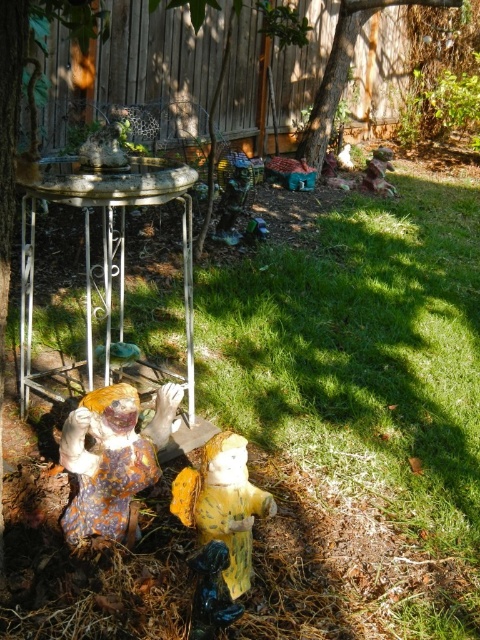
Does metallic silver table at center-left have a larger size compared to speckled ceramic figurine at lower left?

Yes, metallic silver table at center-left is bigger than speckled ceramic figurine at lower left.

Can you confirm if metallic silver table at center-left is positioned above speckled ceramic figurine at lower left?

Yes, metallic silver table at center-left is above speckled ceramic figurine at lower left.

What do you see at coordinates (104, 266) in the screenshot? I see `metallic silver table at center-left` at bounding box center [104, 266].

Locate an element on the screen. This screenshot has height=640, width=480. metallic silver table at center-left is located at coordinates (104, 266).